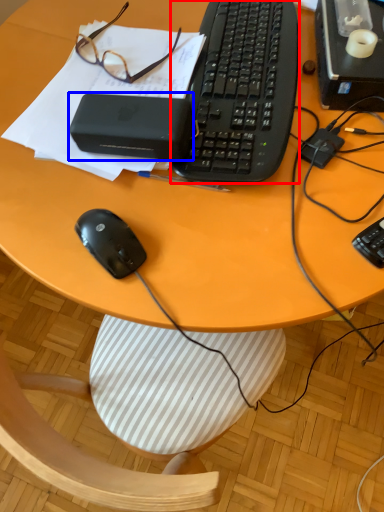
Question: Which object is further to the camera taking this photo, computer keyboard (highlighted by a red box) or gadget (highlighted by a blue box)?

Choices:
 (A) computer keyboard
 (B) gadget

Answer: (A)